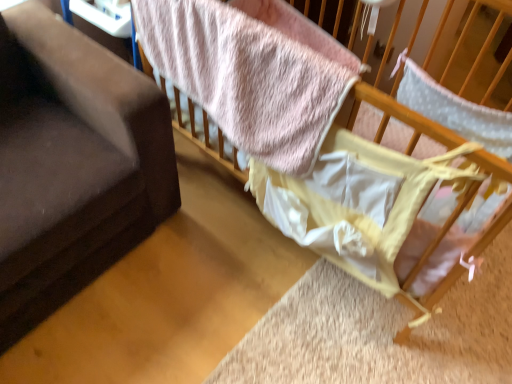
Question: Would you say pink fuzzy blanket at upper center is outside dark gray fabric couch at left?

Choices:
 (A) yes
 (B) no

Answer: (A)

Question: From the image's perspective, is pink fuzzy blanket at upper center beneath dark gray fabric couch at left?

Choices:
 (A) yes
 (B) no

Answer: (B)

Question: From a real-world perspective, is pink fuzzy blanket at upper center located beneath dark gray fabric couch at left?

Choices:
 (A) no
 (B) yes

Answer: (A)

Question: Can dark gray fabric couch at left be found inside pink fuzzy blanket at upper center?

Choices:
 (A) yes
 (B) no

Answer: (B)

Question: Can you confirm if pink fuzzy blanket at upper center is thinner than dark gray fabric couch at left?

Choices:
 (A) yes
 (B) no

Answer: (A)

Question: Is pink fuzzy blanket at upper center smaller than dark gray fabric couch at left?

Choices:
 (A) no
 (B) yes

Answer: (B)

Question: From a real-world perspective, is soft pink fabric at upper right on pink fuzzy blanket at upper center?

Choices:
 (A) yes
 (B) no

Answer: (B)

Question: Are soft pink fabric at upper right and pink fuzzy blanket at upper center far apart?

Choices:
 (A) yes
 (B) no

Answer: (B)

Question: Is pink fuzzy blanket at upper center completely or partially inside soft pink fabric at upper right?

Choices:
 (A) yes
 (B) no

Answer: (A)

Question: Is soft pink fabric at upper right beside pink fuzzy blanket at upper center?

Choices:
 (A) yes
 (B) no

Answer: (B)

Question: Is soft pink fabric at upper right shorter than pink fuzzy blanket at upper center?

Choices:
 (A) no
 (B) yes

Answer: (A)

Question: Is soft pink fabric at upper right closer to the viewer compared to pink fuzzy blanket at upper center?

Choices:
 (A) yes
 (B) no

Answer: (A)

Question: Is dark gray fabric couch at left with pink fuzzy blanket at upper center?

Choices:
 (A) no
 (B) yes

Answer: (A)